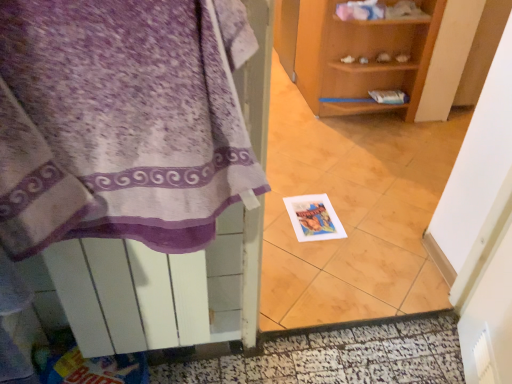
Question: Is white glossy tile at center bigger than white glossy door at lower center?

Choices:
 (A) yes
 (B) no

Answer: (A)

Question: Is white glossy door at lower center a part of white glossy tile at center?

Choices:
 (A) no
 (B) yes

Answer: (A)

Question: Is white glossy tile at center next to white glossy door at lower center and touching it?

Choices:
 (A) yes
 (B) no

Answer: (B)

Question: From the image's perspective, is white glossy tile at center above white glossy door at lower center?

Choices:
 (A) no
 (B) yes

Answer: (B)

Question: From a real-world perspective, is white glossy tile at center below white glossy door at lower center?

Choices:
 (A) yes
 (B) no

Answer: (B)

Question: Could you tell me if white glossy tile at center is facing white glossy door at lower center?

Choices:
 (A) no
 (B) yes

Answer: (A)

Question: Is white paper postcard at center positioned in front of purple fabric towel at left?

Choices:
 (A) no
 (B) yes

Answer: (A)

Question: Can you confirm if white paper postcard at center is taller than purple fabric towel at left?

Choices:
 (A) yes
 (B) no

Answer: (B)

Question: From a real-world perspective, is white paper postcard at center on purple fabric towel at left?

Choices:
 (A) no
 (B) yes

Answer: (A)

Question: Does white paper postcard at center lie behind purple fabric towel at left?

Choices:
 (A) yes
 (B) no

Answer: (A)

Question: Is white paper postcard at center at the right side of purple fabric towel at left?

Choices:
 (A) yes
 (B) no

Answer: (A)

Question: From the image's perspective, is white paper postcard at center over purple fabric towel at left?

Choices:
 (A) yes
 (B) no

Answer: (B)

Question: From a real-world perspective, is wooden shelf at center under white glossy tile at center?

Choices:
 (A) yes
 (B) no

Answer: (A)